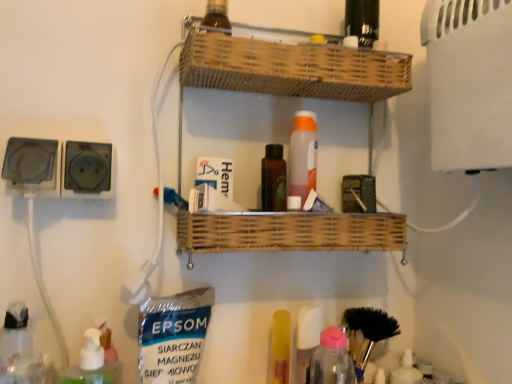
Image resolution: width=512 pixels, height=384 pixels. Identify the location of yellow plastic tube at lower center. (279, 348).

In order to face black plastic socket at left, acting as the 1th electric outlet starting from the left, should I rotate leftwards or rightwards?

Rotate your view left by about 27.212°.

Where is `black plastic socket at left, which is the first electric outlet from right to left`? Image resolution: width=512 pixels, height=384 pixels. black plastic socket at left, which is the first electric outlet from right to left is located at coordinates (87, 170).

Is black plastic socket at left, acting as the 1th electric outlet starting from the left, in front of brown glass bottle at upper center?

Yes, black plastic socket at left, acting as the 1th electric outlet starting from the left, is closer to the viewer.

Can you tell me how much black plastic socket at left, positioned as the 2th electric outlet in right-to-left order, and brown glass bottle at upper center differ in facing direction?

The angle between the facing direction of black plastic socket at left, positioned as the 2th electric outlet in right-to-left order, and the facing direction of brown glass bottle at upper center is 1.1 degrees.

From their relative heights in the image, would you say black plastic socket at left, acting as the 1th electric outlet starting from the left, is taller or shorter than brown glass bottle at upper center?

→ black plastic socket at left, acting as the 1th electric outlet starting from the left, is taller than brown glass bottle at upper center.

Which is more distant, (35, 163) or (207, 28)?

The point (207, 28) is more distant.

What are the coordinates of `brush located below the woven wood shelf at center (from the image's perspective)` in the screenshot? It's located at (367, 333).

From the image's perspective, who appears lower, woven wood shelf at center or black bristle brush at lower right?

black bristle brush at lower right appears lower in the image.

What's the angular difference between woven wood shelf at center and black bristle brush at lower right's facing directions?

The angle between the facing direction of woven wood shelf at center and the facing direction of black bristle brush at lower right is 1.98 degrees.

Could you tell me if woven wood shelf at center is turned towards black bristle brush at lower right?

No, woven wood shelf at center is not turned towards black bristle brush at lower right.

Considering the sizes of objects yellow plastic tube at lower center and black bristle brush at lower right in the image provided, who is shorter, yellow plastic tube at lower center or black bristle brush at lower right?

Standing shorter between the two is yellow plastic tube at lower center.

What's the angular difference between yellow plastic tube at lower center and black bristle brush at lower right's facing directions?

The angular difference between yellow plastic tube at lower center and black bristle brush at lower right is 8.35e-05 degrees.

From the image's perspective, relative to black bristle brush at lower right, is yellow plastic tube at lower center above or below?

From the image's perspective, yellow plastic tube at lower center appears above black bristle brush at lower right.

Is the depth of yellow plastic tube at lower center less than that of black bristle brush at lower right?

Yes, it is.

In the image, is brown glass bottle at upper center positioned in front of or behind yellow plastic tube at lower center?

brown glass bottle at upper center is in front of yellow plastic tube at lower center.

Can yellow plastic tube at lower center be found inside brown glass bottle at upper center?

Actually, yellow plastic tube at lower center is outside brown glass bottle at upper center.

Between brown glass bottle at upper center and yellow plastic tube at lower center, which one has less height?

brown glass bottle at upper center.

From the image's perspective, between brown glass bottle at upper center and yellow plastic tube at lower center, which one is located above?

brown glass bottle at upper center appears higher in the image.

Considering the positions of points (221, 56) and (271, 380), is point (221, 56) closer to camera compared to point (271, 380)?

Yes.

Visually, is woven wood shelf at center positioned to the left or to the right of yellow plastic tube at lower center?

From the image, it's evident that woven wood shelf at center is to the right of yellow plastic tube at lower center.

Who is smaller, woven wood shelf at center or yellow plastic tube at lower center?

Smaller between the two is yellow plastic tube at lower center.

Looking at their sizes, would you say brown glass bottle at upper center is wider or thinner than woven wood shelf at center?

Clearly, brown glass bottle at upper center has less width compared to woven wood shelf at center.

Is the depth of brown glass bottle at upper center greater than that of woven wood shelf at center?

Yes, brown glass bottle at upper center is behind woven wood shelf at center.

Can you confirm if brown glass bottle at upper center is bigger than woven wood shelf at center?

No.

Between yellow plastic tube at lower center and black plastic socket at left, positioned as the 2th electric outlet in right-to-left order, which one has smaller size?

With smaller size is black plastic socket at left, positioned as the 2th electric outlet in right-to-left order.

Which object is further away from the camera, yellow plastic tube at lower center or black plastic socket at left, acting as the 1th electric outlet starting from the left?

yellow plastic tube at lower center is further away from the camera.

From a real-world perspective, does yellow plastic tube at lower center sit lower than black plastic socket at left, acting as the 1th electric outlet starting from the left?

Yes, from a real-world perspective, yellow plastic tube at lower center is under black plastic socket at left, acting as the 1th electric outlet starting from the left.

From the image's perspective, does yellow plastic tube at lower center appear lower than black plastic socket at left, acting as the 1th electric outlet starting from the left?

Yes, from the image's perspective, yellow plastic tube at lower center is beneath black plastic socket at left, acting as the 1th electric outlet starting from the left.

Image resolution: width=512 pixels, height=384 pixels. Identify the location of the 2nd electric outlet in front of the brown glass bottle at upper center. (31, 164).

Identify the location of brush on the right of woven wood shelf at center. 367,333.

Based on their spatial positions, is yellow plastic tube at lower center or black plastic socket at left, which is the first electric outlet from right to left, closer to brown glass bottle at upper center?

black plastic socket at left, which is the first electric outlet from right to left, is positioned closer to the anchor brown glass bottle at upper center.

Which object lies further to the anchor point yellow plastic tube at lower center, black bristle brush at lower right or black plastic socket at left, placed as the second electric outlet when sorted from left to right?

The object further to yellow plastic tube at lower center is black plastic socket at left, placed as the second electric outlet when sorted from left to right.

From the picture: Estimate the real-world distances between objects in this image. Which object is further from black bristle brush at lower right, black plastic socket at left, acting as the 1th electric outlet starting from the left, or brown glass bottle at upper center?

black plastic socket at left, acting as the 1th electric outlet starting from the left, is positioned further to the anchor black bristle brush at lower right.

Consider the image. Estimate the real-world distances between objects in this image. Which object is further from woven wood shelf at center, black plastic socket at left, acting as the 1th electric outlet starting from the left, or brown glass bottle at upper center?

black plastic socket at left, acting as the 1th electric outlet starting from the left.

From the picture: Which object lies nearer to the anchor point yellow plastic tube at lower center, black plastic socket at left, which is the first electric outlet from right to left, or brown glass bottle at upper center?

black plastic socket at left, which is the first electric outlet from right to left, lies closer to yellow plastic tube at lower center than the other object.

Which object lies further to the anchor point woven wood shelf at center, yellow plastic tube at lower center or black plastic socket at left, acting as the 1th electric outlet starting from the left?

The object further to woven wood shelf at center is black plastic socket at left, acting as the 1th electric outlet starting from the left.

From the image, which object appears to be farther from woven wood shelf at center, yellow plastic tube at lower center or black bristle brush at lower right?

The object further to woven wood shelf at center is black bristle brush at lower right.

Based on their spatial positions, is black bristle brush at lower right or black plastic socket at left, positioned as the 2th electric outlet in right-to-left order, further from woven wood shelf at center?

black plastic socket at left, positioned as the 2th electric outlet in right-to-left order.

This screenshot has width=512, height=384. I want to click on shelf between brown glass bottle at upper center and black bristle brush at lower right in the up-down direction, so click(288, 70).

Where is `electric outlet between black plastic socket at left, acting as the 1th electric outlet starting from the left, and black bristle brush at lower right from left to right`? Image resolution: width=512 pixels, height=384 pixels. electric outlet between black plastic socket at left, acting as the 1th electric outlet starting from the left, and black bristle brush at lower right from left to right is located at coordinates (87, 170).

You are a GUI agent. You are given a task and a screenshot of the screen. Output one action in this format:
    pyautogui.click(x=<x>, y=<y>)
    Task: Click on the bottle between black plastic socket at left, placed as the second electric outlet when sorted from left to right, and woven wood shelf at center, in the horizontal direction
    
    Given the screenshot: What is the action you would take?
    pyautogui.click(x=216, y=17)

At what (x,y) coordinates should I click in order to perform the action: click on electric outlet situated between black plastic socket at left, positioned as the 2th electric outlet in right-to-left order, and yellow plastic tube at lower center from left to right. Please return your answer as a coordinate pair (x, y). The width and height of the screenshot is (512, 384). Looking at the image, I should click on (87, 170).